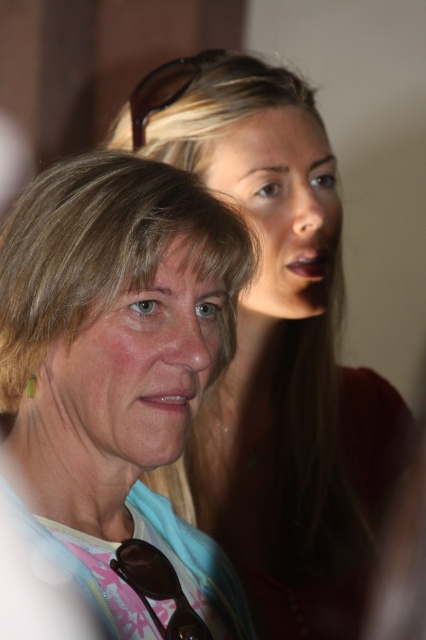
Looking at this image, is matte white shirt at center thinner than matte skin at center?

Result: Correct, matte white shirt at center's width is less than matte skin at center's.

Based on the photo, can you confirm if matte white shirt at center is wider than matte skin at center?

No, matte white shirt at center is not wider than matte skin at center.

Who is more distant from viewer, (x=158, y=525) or (x=336, y=292)?

Positioned behind is point (x=336, y=292).

You are a GUI agent. You are given a task and a screenshot of the screen. Output one action in this format:
    pyautogui.click(x=<x>, y=<y>)
    Task: Click on the matte white shirt at center
    The height and width of the screenshot is (640, 426).
    Given the screenshot: What is the action you would take?
    pyautogui.click(x=115, y=387)

Does matte skin at center lie behind smooth skin face at center?

Yes, matte skin at center is behind smooth skin face at center.

Does matte skin at center appear on the left side of smooth skin face at center?

No, matte skin at center is not to the left of smooth skin face at center.

Is point (340, 486) positioned in front of point (74, 388)?

No.

You are a GUI agent. You are given a task and a screenshot of the screen. Output one action in this format:
    pyautogui.click(x=<x>, y=<y>)
    Task: Click on the matte skin at center
    The image size is (426, 640).
    Given the screenshot: What is the action you would take?
    pyautogui.click(x=276, y=352)

How much distance is there between smooth skin face at center and smooth skin face at upper center?

They are 13.45 inches apart.

Locate an element on the screen. Image resolution: width=426 pixels, height=640 pixels. smooth skin face at center is located at coordinates (134, 372).

Find the location of `smooth skin face at center`. smooth skin face at center is located at coordinates (134, 372).